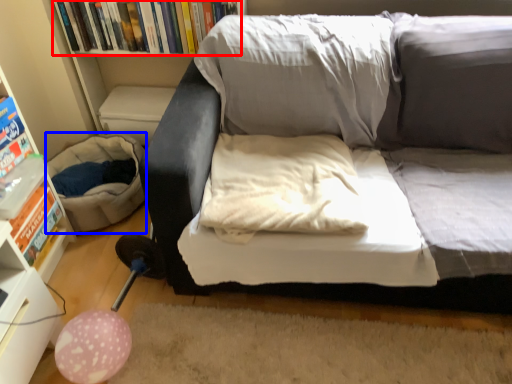
Question: Which of the following is the farthest to the observer, book (highlighted by a red box) or bean bag chair (highlighted by a blue box)?

Choices:
 (A) book
 (B) bean bag chair

Answer: (A)